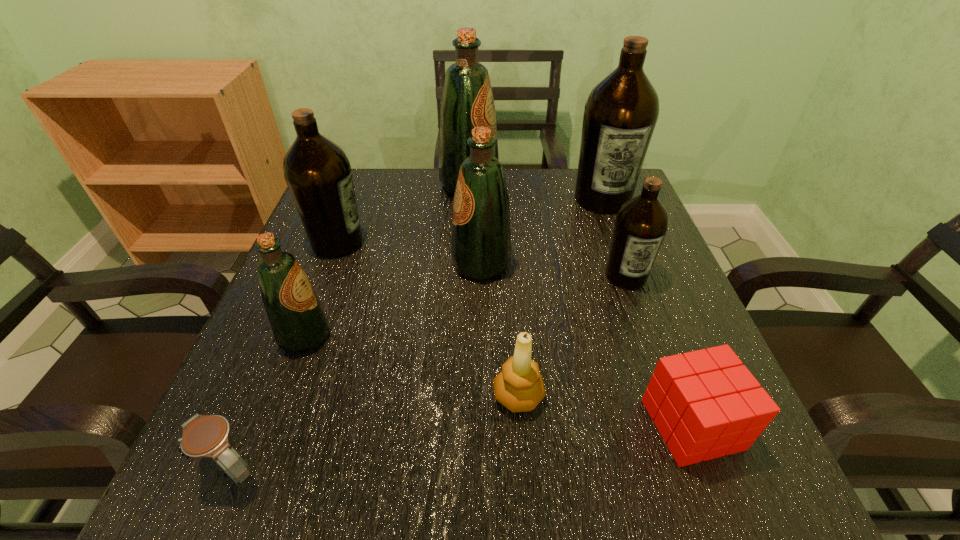
Locate an element on the screen. free space at the near edge of the desktop is located at coordinates point(520,466).

In the image, there is a desktop. Identify the location of vacant space at the left edge. The height and width of the screenshot is (540, 960). (371, 232).

Image resolution: width=960 pixels, height=540 pixels. I want to click on free space at the right edge of the desktop, so click(588, 244).

In the image, there is a desktop. Identify the location of vacant region at the near right corner. This screenshot has width=960, height=540. (715, 470).

I want to click on free space that is in between the nearest brown olive oil and the farthest green olive oil, so click(547, 231).

What are the coordinates of `unoccupied area between the nearest brown olive oil and the leftmost green olive oil` in the screenshot? It's located at pos(466,306).

The width and height of the screenshot is (960, 540). Identify the location of free space between the farthest green olive oil and the cube. (581, 305).

In order to click on empty space that is in between the red cube and the nearest brown olive oil in this screenshot , I will do `click(659, 350)`.

Where is `vacant area that lies between the nearest brown olive oil and the leftmost green olive oil`? The width and height of the screenshot is (960, 540). vacant area that lies between the nearest brown olive oil and the leftmost green olive oil is located at coordinates (466, 306).

Where is `vacant space in between the biggest brown olive oil and the candle_holder`? Image resolution: width=960 pixels, height=540 pixels. vacant space in between the biggest brown olive oil and the candle_holder is located at coordinates (561, 298).